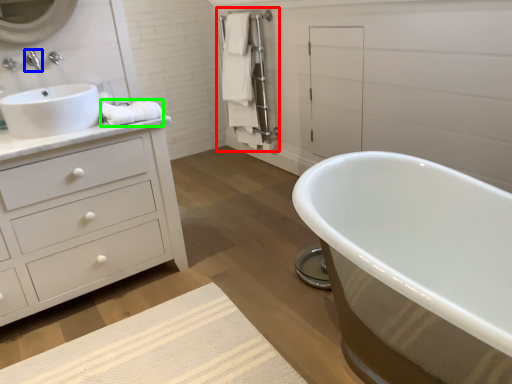
Question: Which object is the farthest from closet (highlighted by a red box)? Choose among these: tap (highlighted by a blue box) or material (highlighted by a green box).

Choices:
 (A) tap
 (B) material

Answer: (A)